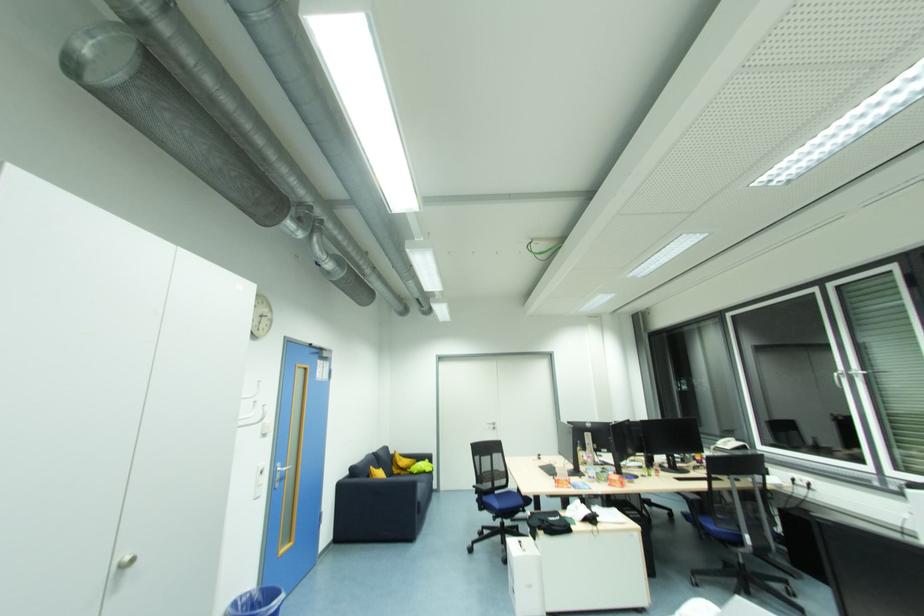
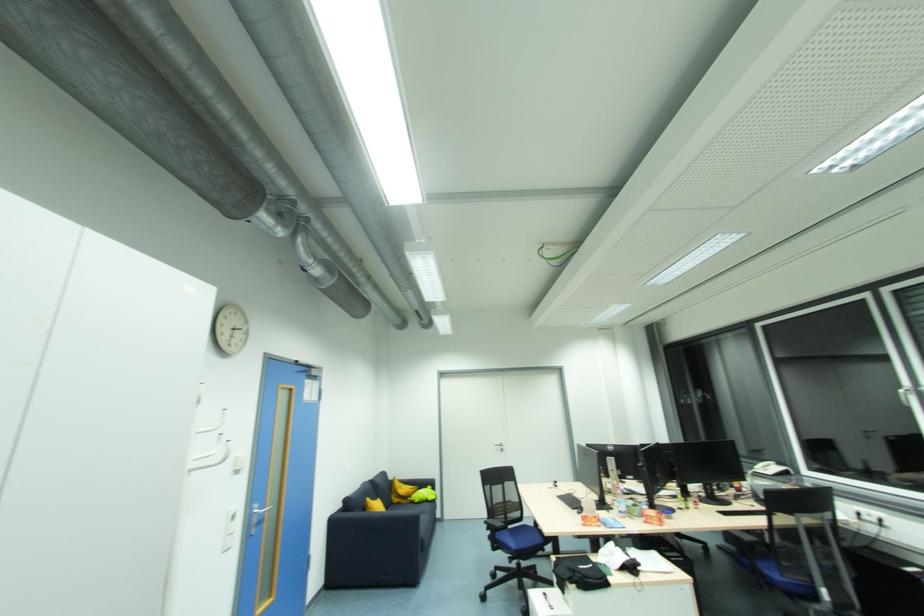
The point at (485, 506) is marked in the first image. Where is the corresponding point in the second image?

(497, 546)